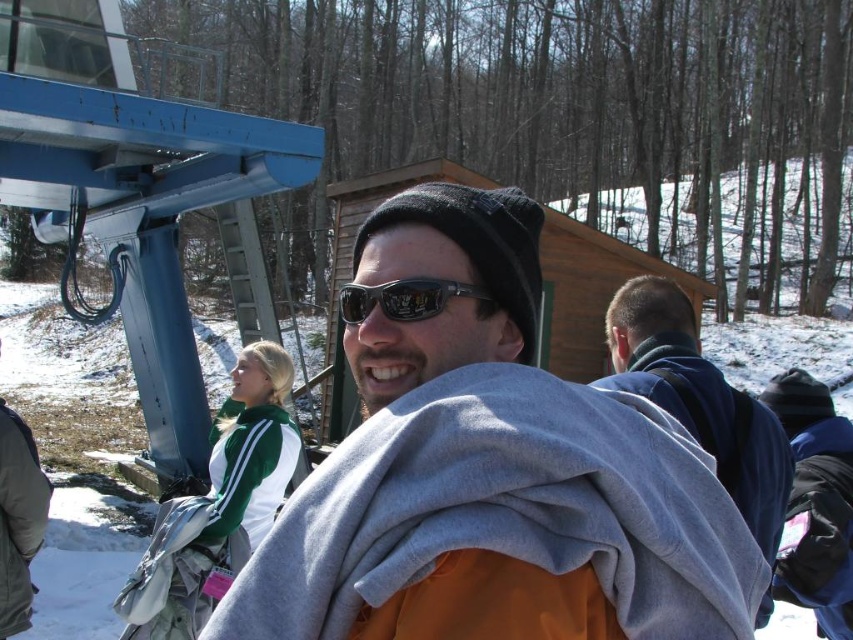
Question: Which point is closer to the camera?

Choices:
 (A) gray fleece scarf at center
 (B) blue fleece jacket at upper right
 (C) black reflective sunglasses at center

Answer: (A)

Question: Can you confirm if gray fleece scarf at center is smaller than black reflective sunglasses at center?

Choices:
 (A) no
 (B) yes

Answer: (A)

Question: Which object appears farthest from the camera in this image?

Choices:
 (A) blue fleece jacket at upper right
 (B) gray fleece scarf at center

Answer: (A)

Question: Which of the following is the farthest from the observer?

Choices:
 (A) gray fleece scarf at center
 (B) black reflective sunglasses at center
 (C) blue fleece jacket at upper right

Answer: (C)

Question: Is gray fleece scarf at center closer to the viewer compared to black reflective sunglasses at center?

Choices:
 (A) yes
 (B) no

Answer: (A)

Question: Is gray fleece scarf at center above blue fleece jacket at upper right?

Choices:
 (A) no
 (B) yes

Answer: (B)